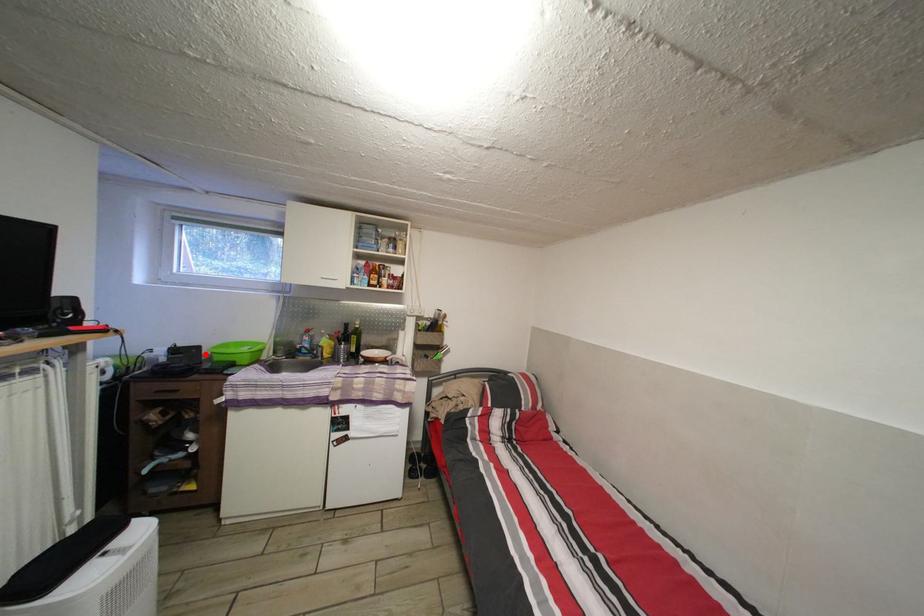
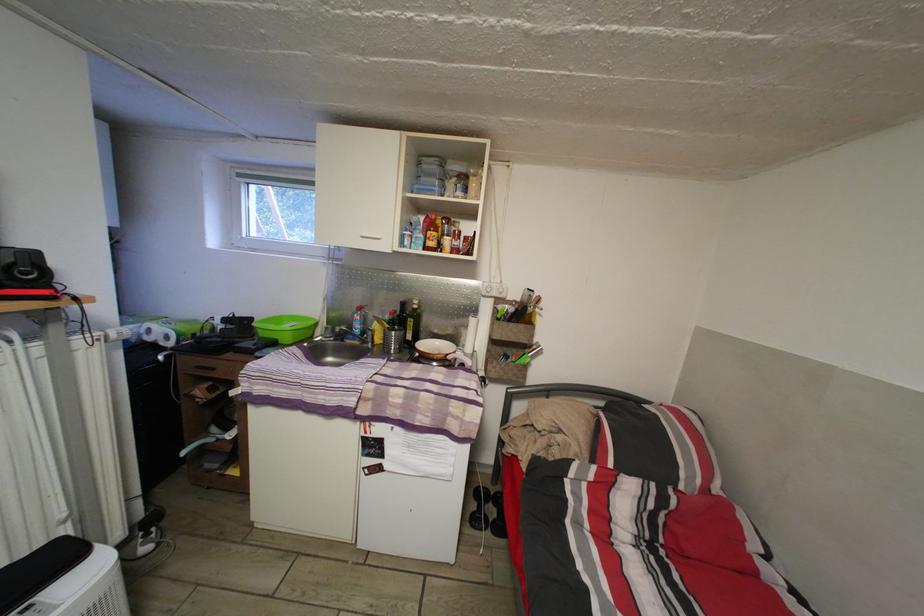
In the second image, find the point that corresponds to the highlighted location in the first image.

(257, 326)